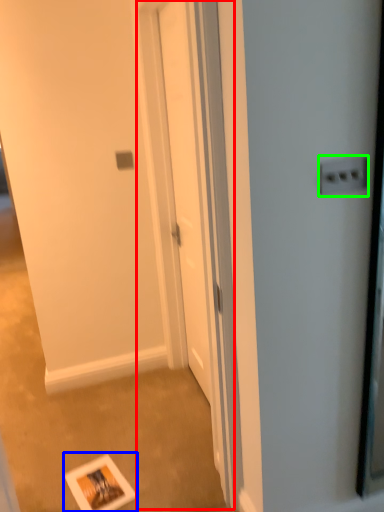
Question: Based on their relative distances, which object is nearer to screen door (highlighted by a red box)? Choose from postcard (highlighted by a blue box) and electric outlet (highlighted by a green box).

Choices:
 (A) postcard
 (B) electric outlet

Answer: (A)